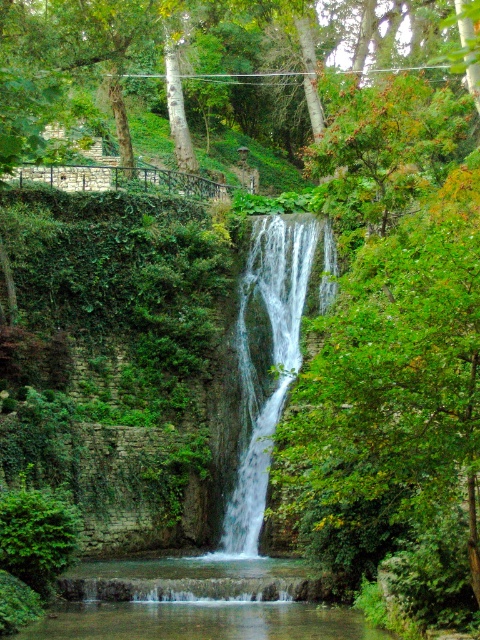
You are standing at the camera position observing the serene natural scene. There is a point marked at coordinates point (200,122). Can you estimate how far this point is from your current position?

The point (200,122) is 116.51 meters away from the camera, so the distance is approximately 116.51 meters.

Looking at this image, you are a hiker who wants to cross the waterfall area. You see clear water at center and white frothy water at center. Which part of the water would be safer to step on?

The clear water at center has a lesser height compared to the white frothy water at center, so stepping on the clear water at center would be safer as it is less turbulent and deeper.

You are standing at the bottom of the waterfall and want to climb up to the green leafy tree at upper center. Is the tree above or below the white frothy water at center?

The green leafy tree at upper center is above the white frothy water at center, so the tree is located above the water.